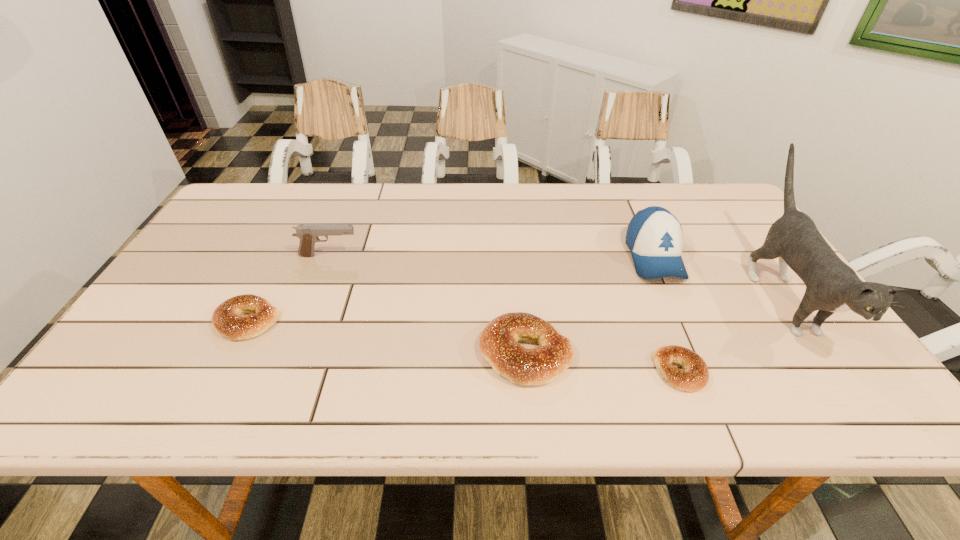
Locate an element on the screen. The height and width of the screenshot is (540, 960). vacant position in the image that satisfies the following two spatial constraints: 1. on the back side of the fourth object from right to left; 2. at the barrel of the pistol is located at coordinates (516, 255).